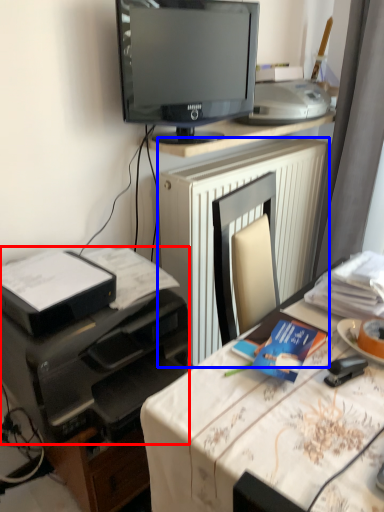
Question: Which object appears closest to the camera in this image, printer (highlighted by a red box) or radiator (highlighted by a blue box)?

Choices:
 (A) printer
 (B) radiator

Answer: (A)